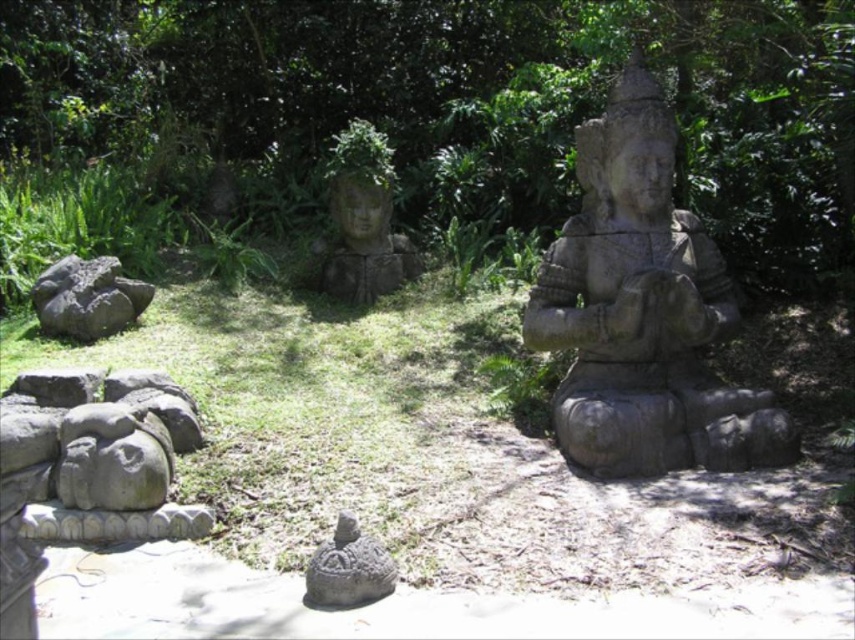
Question: Which of the following is the closest to the observer?

Choices:
 (A) gray rough rock at lower left
 (B) green leafy tree at center
 (C) gray stone statue at center

Answer: (C)

Question: Among these objects, which one is nearest to the camera?

Choices:
 (A) gray stone turtle at center
 (B) green mossy stone head at center
 (C) gray stone head at lower left

Answer: (A)

Question: Which point is farther to the camera?

Choices:
 (A) gray stone head at lower left
 (B) green leafy tree at center

Answer: (B)

Question: Does gray stone head at lower left have a smaller size compared to gray rough rock at lower left?

Choices:
 (A) yes
 (B) no

Answer: (B)

Question: Does gray stone statue at center come in front of gray stone turtle at center?

Choices:
 (A) no
 (B) yes

Answer: (A)

Question: Does green mossy stone head at center appear on the left side of gray rough rock at lower left?

Choices:
 (A) no
 (B) yes

Answer: (A)